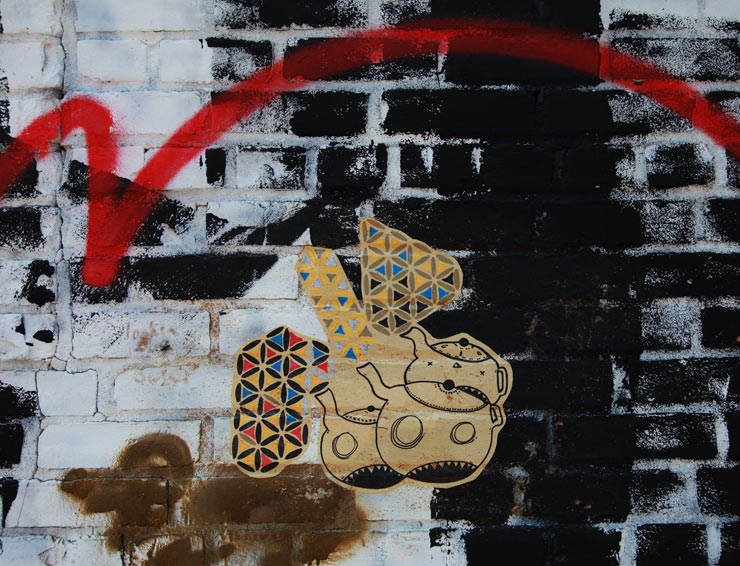
In order to click on empty space on wall in this screenshot , I will do `click(636, 277)`.